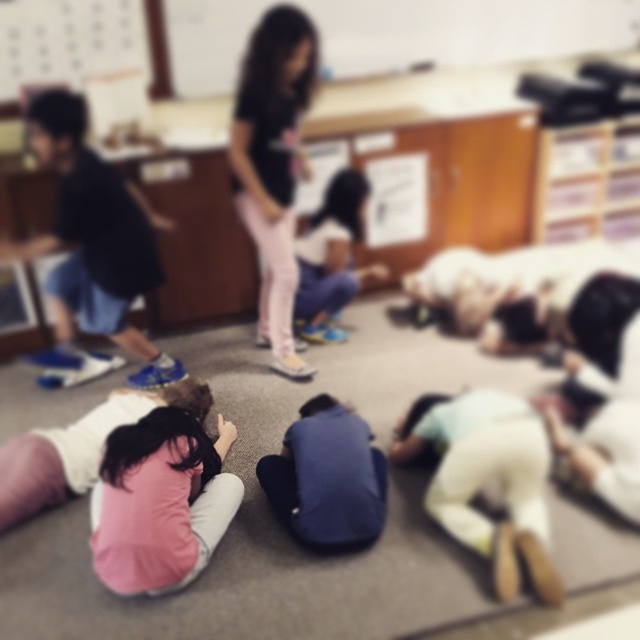
You are a teacher observing the classroom scene. You notice the blue athletic shoes at left and the pink fabric shirt at lower left. Which object is positioned higher in the image?

The blue athletic shoes at left is located above the pink fabric shirt at lower left, so it is positioned higher in the image.

You are a photographer who wants to adjust the lighting in the classroom to better highlight both the white matte shirt at lower right and the blue fabric at center. Based on their positions, which object is closer to the right side of the image?

The white matte shirt at lower right is to the right of the blue fabric at center, so it is closer to the right side of the image.

You are standing at the point labeled as point (x=451, y=506) in the classroom. You want to retrieve a pencil that is on the desk located at the back of the room. Considering your height is 1.65 meters, can you see over the heads of the children lying on the floor to spot the pencil on the desk?

The point labeled as point (x=451, y=506) is 2.20 meters away from the viewer. Since the children are lying on the floor and the desk is at the back, the distance and their posture might block the view. However, without specific height details of the children or desk, it is uncertain if you can see the pencil.